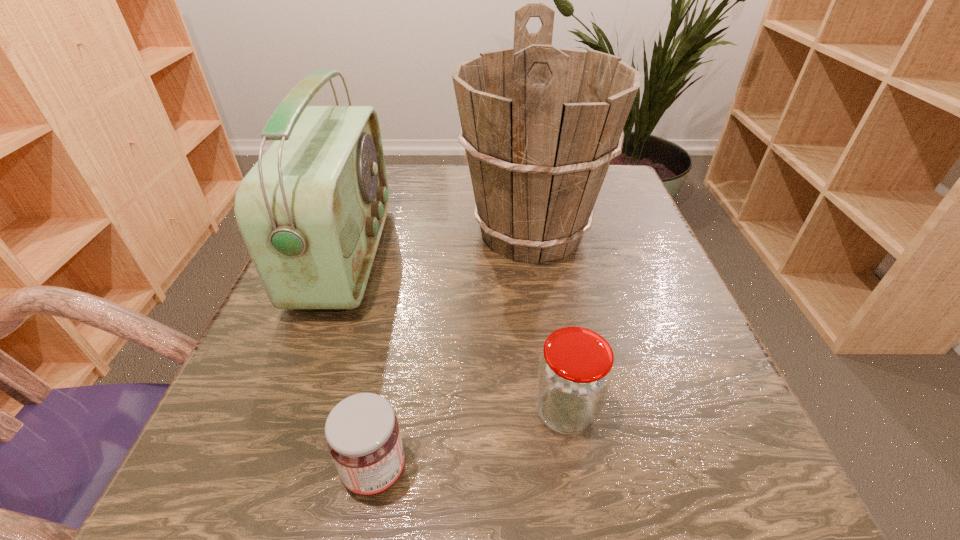
Locate an element on the screen. bucket is located at coordinates (540, 125).

Where is `radio receiver`? radio receiver is located at coordinates (311, 211).

What are the coordinates of `the leftmost object` in the screenshot? It's located at (311, 211).

The width and height of the screenshot is (960, 540). What are the coordinates of `jar` in the screenshot? It's located at (575, 368).

Locate an element on the screen. This screenshot has height=540, width=960. jam is located at coordinates (363, 437).

Identify the location of the third object from right to left. (363, 437).

Where is `free region located 0.270m on the front of the tallest object`? free region located 0.270m on the front of the tallest object is located at coordinates (559, 410).

Image resolution: width=960 pixels, height=540 pixels. Find the location of `vacant space located on the front panel of the second tallest object`. vacant space located on the front panel of the second tallest object is located at coordinates (447, 255).

Identify the location of vacant space situated on the back of the jar. (539, 250).

Where is `blank space located 0.110m on the back of the shortest object`? The height and width of the screenshot is (540, 960). blank space located 0.110m on the back of the shortest object is located at coordinates (393, 372).